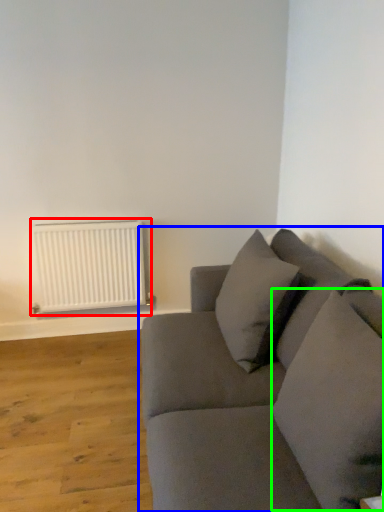
Question: Estimate the real-world distances between objects in this image. Which object is closer to radiator (highlighted by a red box), studio couch (highlighted by a blue box) or pillow (highlighted by a green box)?

Choices:
 (A) studio couch
 (B) pillow

Answer: (A)